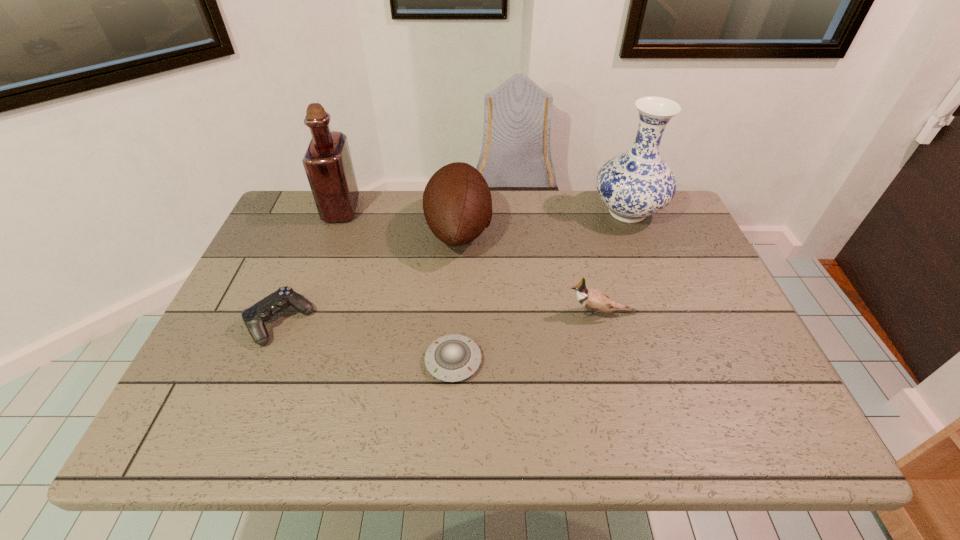
I want to click on free spot located at the face of the bird, so click(x=402, y=313).

Identify the location of vacant region located 0.100m at the face of the bird. This screenshot has height=540, width=960. (524, 313).

Find the location of `free space located 0.180m on the right of the fifth tallest object`. free space located 0.180m on the right of the fifth tallest object is located at coordinates (386, 322).

Find the location of a particular element. Image resolution: width=960 pixels, height=540 pixels. free space located on the back of the shortest object is located at coordinates (459, 253).

Locate an element on the screen. This screenshot has width=960, height=540. vase present at the far edge is located at coordinates (635, 184).

This screenshot has width=960, height=540. I want to click on liquor located at the far edge, so click(327, 162).

The width and height of the screenshot is (960, 540). Identify the location of football present at the far edge. (457, 204).

Where is `liquor that is at the left edge`? liquor that is at the left edge is located at coordinates (327, 162).

Find the location of a particular element. The height and width of the screenshot is (540, 960). control at the left edge is located at coordinates (254, 317).

Find the location of a particular element. Image resolution: width=960 pixels, height=540 pixels. object positioned at the right edge is located at coordinates (635, 184).